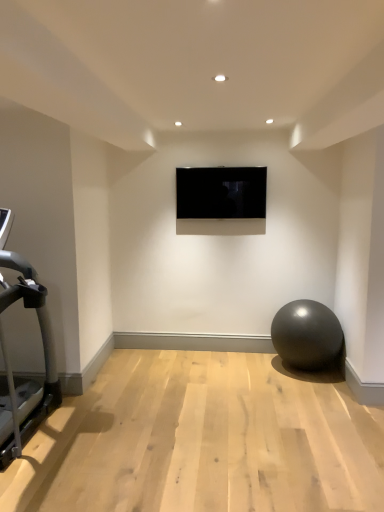
Question: From a real-world perspective, is silver metallic treadmill at left above or below glossy rubber ball at lower right?

Choices:
 (A) below
 (B) above

Answer: (B)

Question: Considering the positions of point (3, 394) and point (340, 340), is point (3, 394) closer or farther from the camera than point (340, 340)?

Choices:
 (A) farther
 (B) closer

Answer: (B)

Question: Estimate the real-world distances between objects in this image. Which object is closer to the black glossy tv at center?

Choices:
 (A) silver metallic treadmill at left
 (B) glossy rubber ball at lower right

Answer: (B)

Question: Which object is the closest to the black glossy tv at center?

Choices:
 (A) glossy rubber ball at lower right
 (B) silver metallic treadmill at left

Answer: (A)